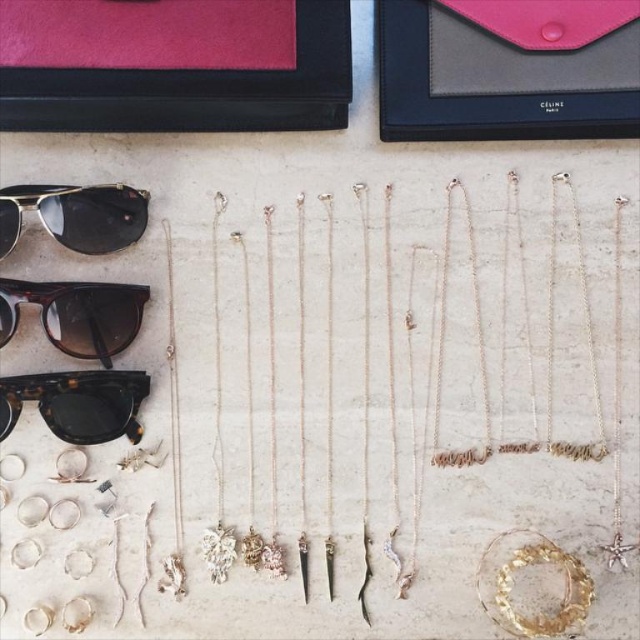
Question: Can you confirm if brown tortoiseshell sunglasses at upper left is wider than metallic reflective sunglasses at upper left?

Choices:
 (A) no
 (B) yes

Answer: (A)

Question: Does brown tortoiseshell sunglasses at upper left have a smaller size compared to tortoiseshell acetate sunglasses at lower left?

Choices:
 (A) no
 (B) yes

Answer: (A)

Question: Based on their relative distances, which object is farther from the tortoiseshell acetate sunglasses at lower left?

Choices:
 (A) brown tortoiseshell sunglasses at upper left
 (B) metallic reflective sunglasses at upper left

Answer: (B)

Question: From the image, what is the correct spatial relationship of brown tortoiseshell sunglasses at upper left in relation to metallic reflective sunglasses at upper left?

Choices:
 (A) above
 (B) below

Answer: (B)

Question: Which of these objects is positioned farthest from the brown tortoiseshell sunglasses at upper left?

Choices:
 (A) metallic reflective sunglasses at upper left
 (B) tortoiseshell acetate sunglasses at lower left

Answer: (A)

Question: Estimate the real-world distances between objects in this image. Which object is farther from the tortoiseshell acetate sunglasses at lower left?

Choices:
 (A) brown tortoiseshell sunglasses at upper left
 (B) metallic reflective sunglasses at upper left

Answer: (B)